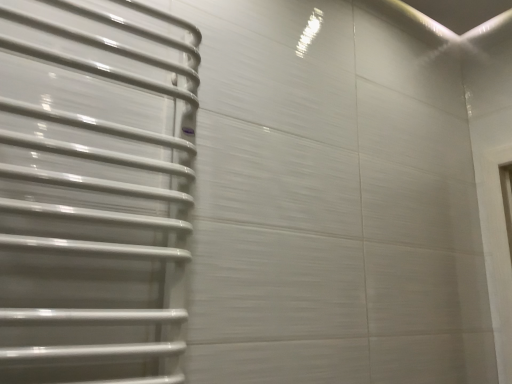
The width and height of the screenshot is (512, 384). What do you see at coordinates (95, 190) in the screenshot?
I see `white glossy towel rack at left` at bounding box center [95, 190].

Image resolution: width=512 pixels, height=384 pixels. Find the location of `white glossy towel rack at left`. white glossy towel rack at left is located at coordinates (95, 190).

Locate an element on the screen. white glossy towel rack at left is located at coordinates (95, 190).